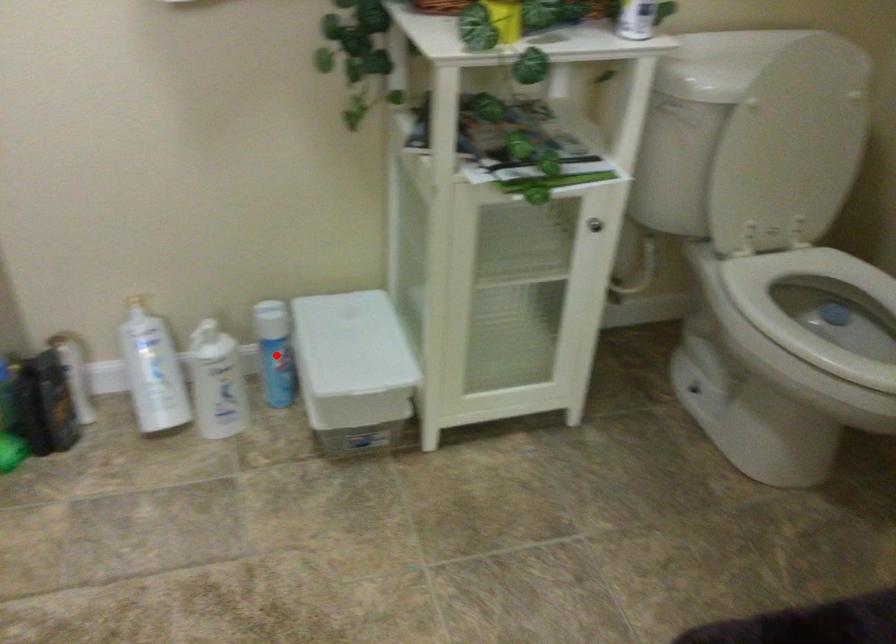
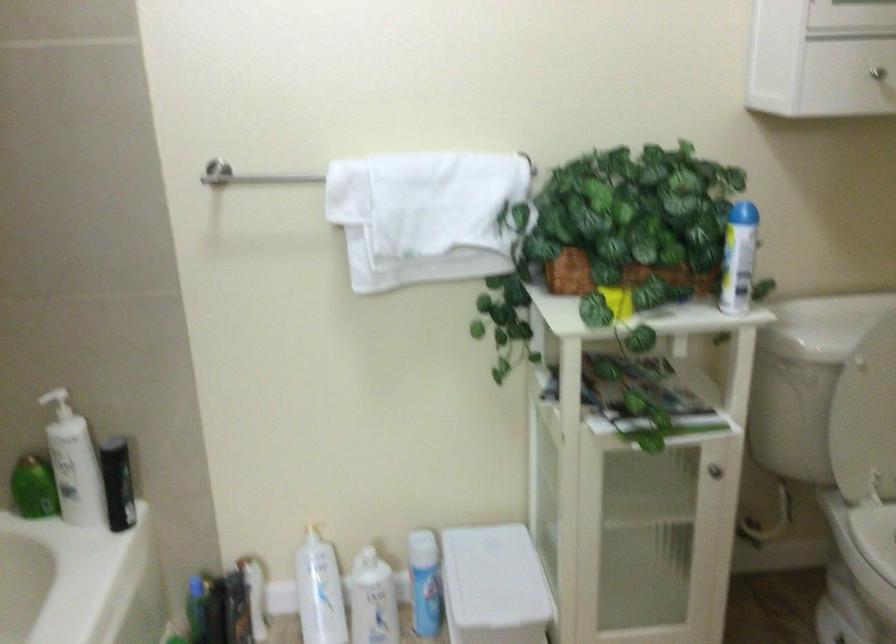
Where in the second image is the point corresponding to the highlighted location from the first image?

(424, 583)